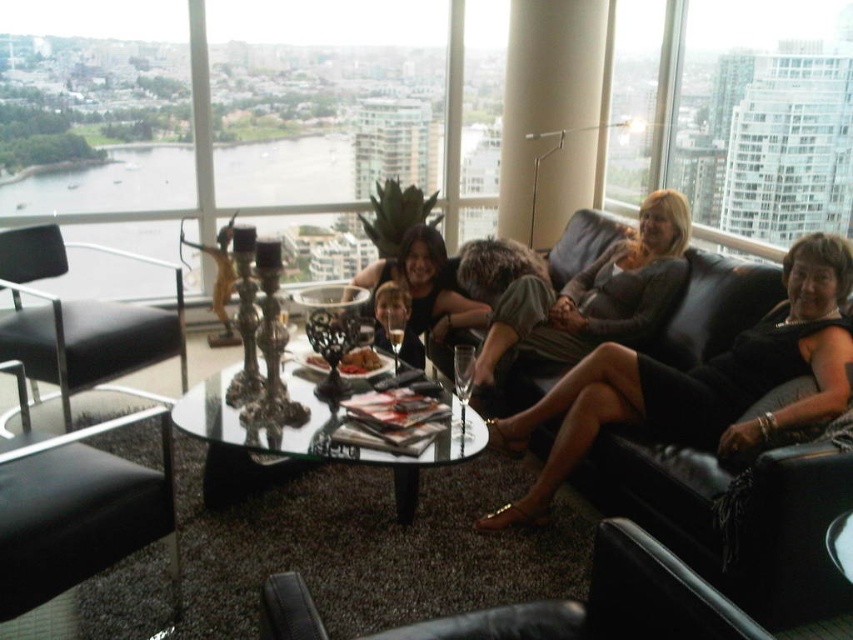
Based on the photo, you are a guest entering the living room and want to sit down. You see the black leather armchair at lower left and the matte black dress at center. Which one is taller?

The black leather armchair at lower left is taller than the matte black dress at center.

You are standing in the living room and want to place a 2.5 meter long ladder from the sofa to the point at coordinates point (793,352). Will the ladder fit without bending or overlapping?

The distance to point (793,352) is 2.46 meters, so the ladder is slightly longer than the required distance. It will fit but may need to be angled carefully to avoid overlapping objects.

You are organizing a charity event and need to choose a dress that takes up less space on the table. Which dress should you select between the matte gray dress at center and the matte black dress at center?

The matte black dress at center is smaller than the matte gray dress at center, so you should select the matte black dress at center to save space on the table.